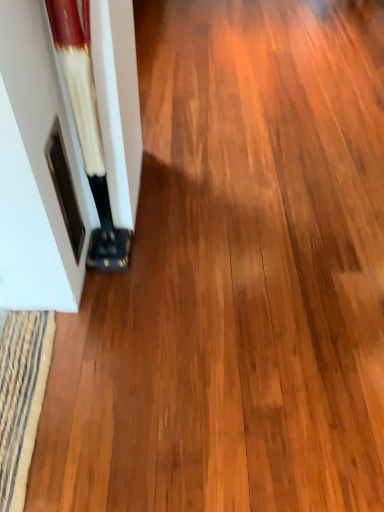
This screenshot has width=384, height=512. In order to click on space that is in front of white glossy door at left in this screenshot , I will do (109, 293).